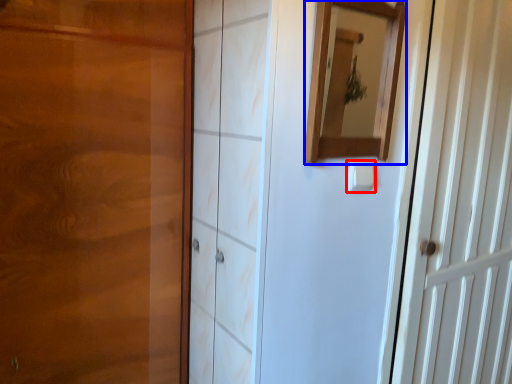
Question: Which object appears closest to the camera in this image, light switch (highlighted by a red box) or mirror (highlighted by a blue box)?

Choices:
 (A) light switch
 (B) mirror

Answer: (B)